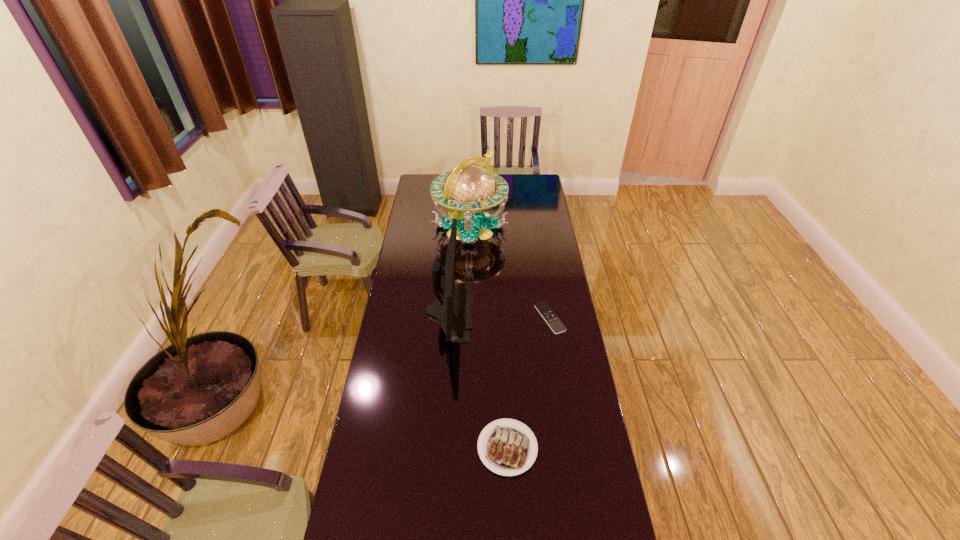
The image size is (960, 540). What are the coordinates of `the farthest object` in the screenshot? It's located at (469, 188).

Where is `globe`? The width and height of the screenshot is (960, 540). globe is located at coordinates (469, 188).

Where is `the second tallest object`? The height and width of the screenshot is (540, 960). the second tallest object is located at coordinates (453, 312).

The width and height of the screenshot is (960, 540). In order to click on the nearest object in this screenshot , I will do `click(506, 448)`.

I want to click on the second shortest object, so click(506, 448).

Where is `the rightmost object`? the rightmost object is located at coordinates (544, 309).

I want to click on the shortest object, so click(x=544, y=309).

The height and width of the screenshot is (540, 960). What are the coordinates of `vacant position located on the front of the farthest object` in the screenshot? It's located at (468, 306).

I want to click on free space located on the screen side of the third shortest object, so click(x=516, y=312).

The height and width of the screenshot is (540, 960). I want to click on vacant position located on the back of the nearest object, so click(x=504, y=382).